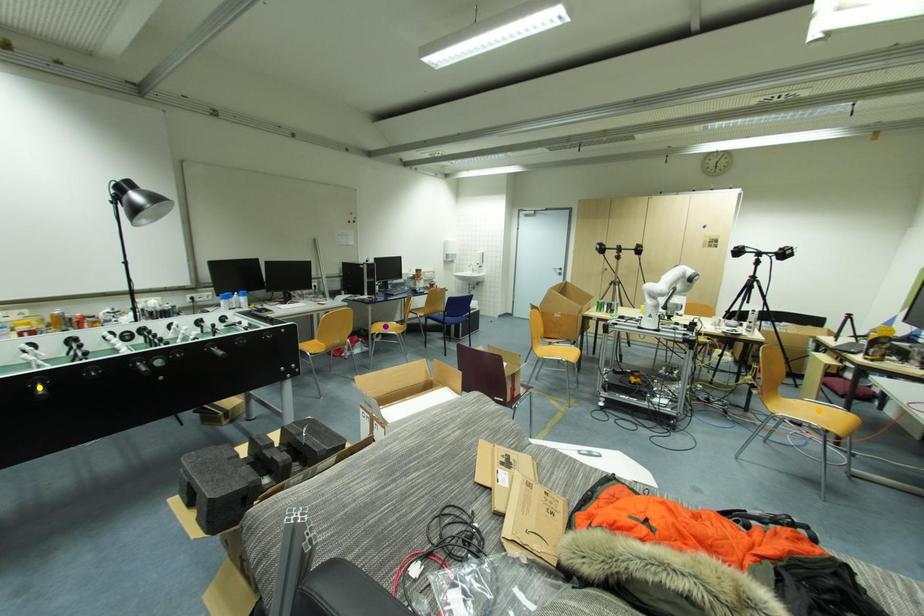
Order these from nearest to farthest:
1. purple point
2. orange point
3. yellow point

1. yellow point
2. orange point
3. purple point